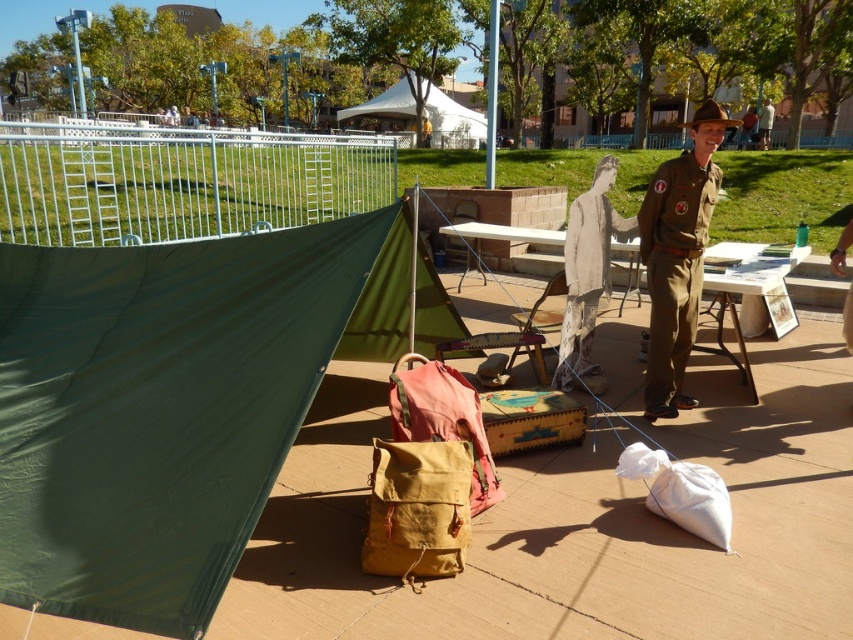
You are a reenactor participating in a historical event. You need to retrieve your gear from the brown canvas backpack at center, but you are currently standing next to the brown uniform at center. Can you reach the backpack without moving more than 1.5 meters?

The distance between the brown uniform at center and the brown canvas backpack at center is 1.76 meters, which is greater than 1.5 meters. Therefore, you cannot reach the backpack without moving more than 1.5 meters.

You are a visitor at this historical event and want to find the main information booth. You see a green canvas tent at left and a white canvas tent at upper center. According to their positions, which tent is closer to the entrance if the entrance is on the right side of the scene?

The green canvas tent at left is to the right of the white canvas tent at upper center, so if the entrance is on the right side of the scene, the green canvas tent at left is closer to the entrance.